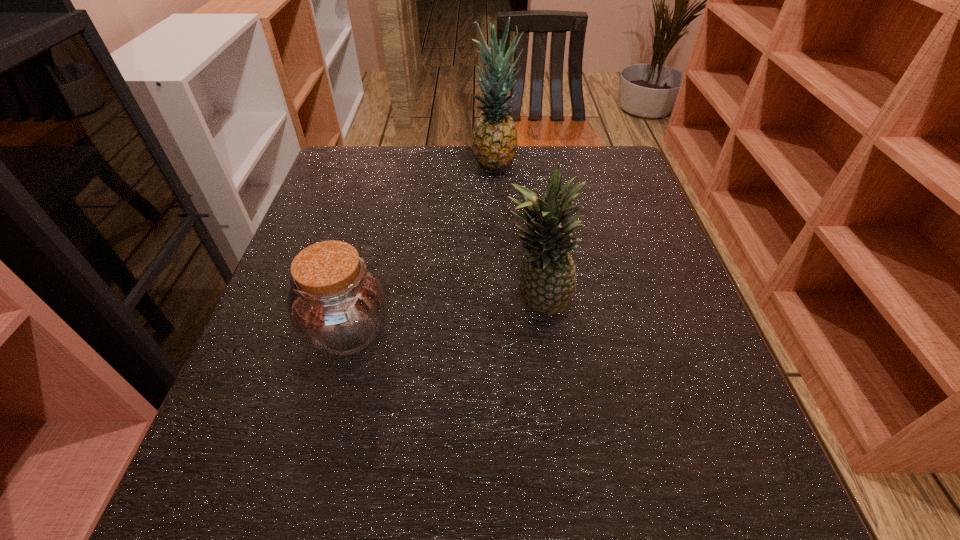
Where is `object that is the second closest to the shortest object`? The height and width of the screenshot is (540, 960). object that is the second closest to the shortest object is located at coordinates (494, 138).

Where is `vacant space that satisfies the following two spatial constraints: 1. on the back side of the tallest object; 2. on the left side of the jar`? Image resolution: width=960 pixels, height=540 pixels. vacant space that satisfies the following two spatial constraints: 1. on the back side of the tallest object; 2. on the left side of the jar is located at coordinates tap(392, 164).

Find the location of `vacant space that satisfies the following two spatial constraints: 1. on the front side of the second shortest object; 2. on the right side of the tallest object`. vacant space that satisfies the following two spatial constraints: 1. on the front side of the second shortest object; 2. on the right side of the tallest object is located at coordinates (500, 303).